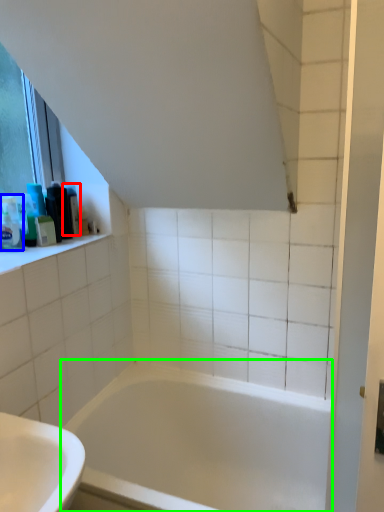
Question: Which object is positioned farthest from toiletry (highlighted by a red box)? Select from toiletry (highlighted by a blue box) and bathtub (highlighted by a green box).

Choices:
 (A) toiletry
 (B) bathtub

Answer: (B)